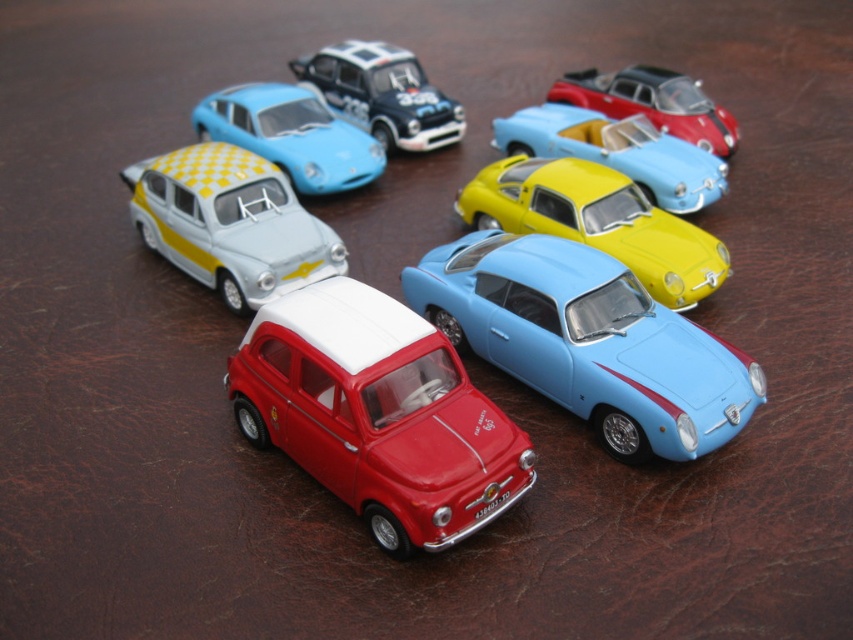
Does matte black car at upper center have a lesser height compared to shiny red car at upper right?

In fact, matte black car at upper center may be taller than shiny red car at upper right.

In the scene shown: Between matte black car at upper center and shiny red car at upper right, which one has less height?

shiny red car at upper right

The height and width of the screenshot is (640, 853). What do you see at coordinates (381, 93) in the screenshot?
I see `matte black car at upper center` at bounding box center [381, 93].

The height and width of the screenshot is (640, 853). I want to click on matte black car at upper center, so click(381, 93).

Is shiny red car at center bigger than shiny red car at upper right?

Indeed, shiny red car at center has a larger size compared to shiny red car at upper right.

Who is positioned more to the right, shiny red car at center or shiny red car at upper right?

shiny red car at upper right

Where is `shiny red car at center`? This screenshot has width=853, height=640. shiny red car at center is located at coordinates (376, 413).

Who is more forward, (321, 177) or (306, 72)?

Positioned in front is point (321, 177).

Describe the element at coordinates (291, 134) in the screenshot. This screenshot has width=853, height=640. I see `checkered fabric car at upper left` at that location.

Where is `checkered fabric car at upper left`? Image resolution: width=853 pixels, height=640 pixels. checkered fabric car at upper left is located at coordinates (291, 134).